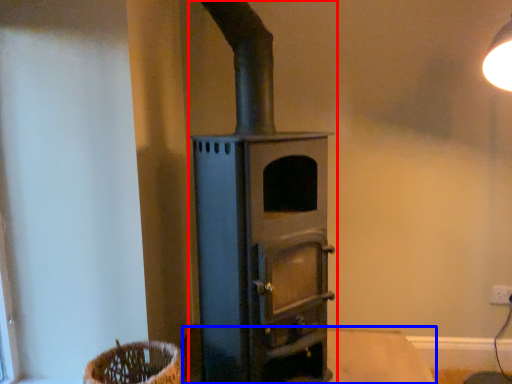
Question: Which point is closer to the camera, wood burning stove (highlighted by a red box) or table (highlighted by a blue box)?

Choices:
 (A) wood burning stove
 (B) table

Answer: (A)